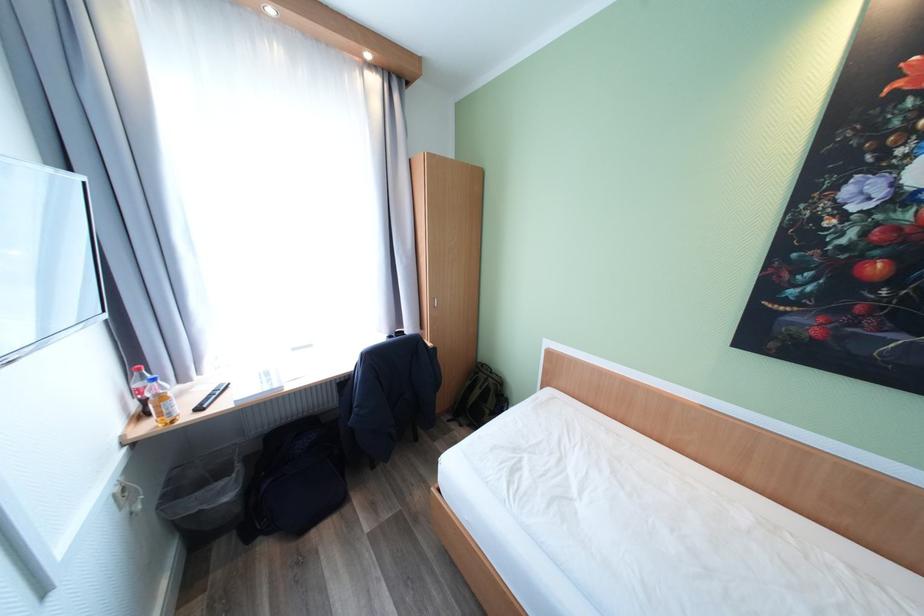
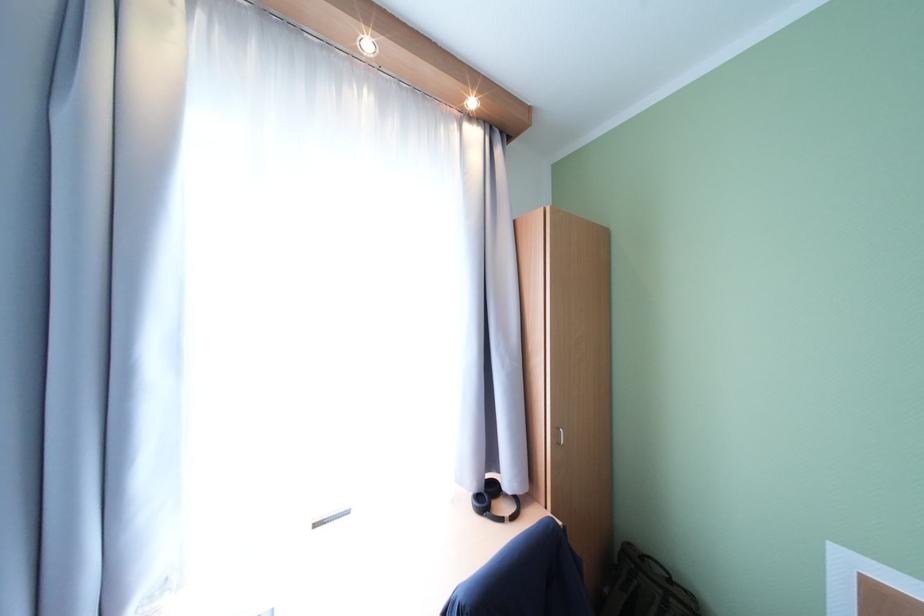
Where in the second image is the point corresponding to point 496,379 from the first image?

(679, 602)